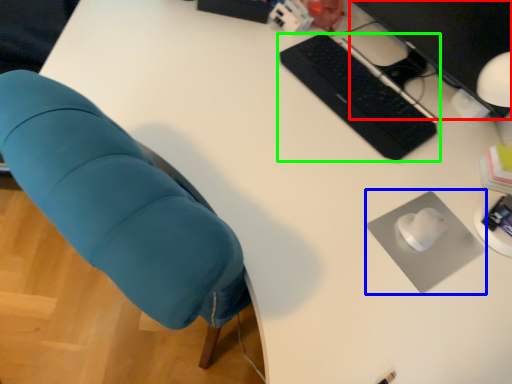
Question: Which is farther away from computer monitor (highlighted by a red box)? mousepad (highlighted by a blue box) or computer keyboard (highlighted by a green box)?

Choices:
 (A) mousepad
 (B) computer keyboard

Answer: (A)